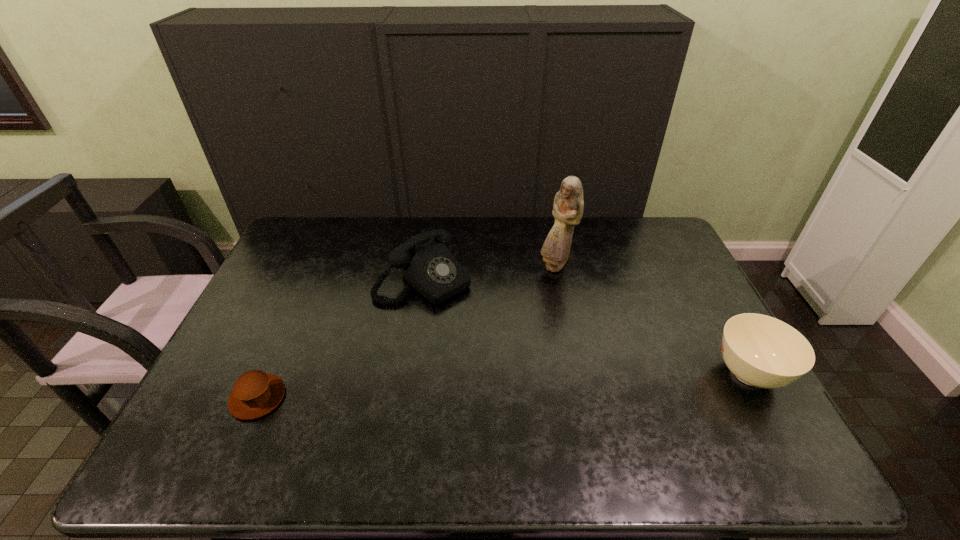
Locate an element on the screen. The width and height of the screenshot is (960, 540). the leftmost object is located at coordinates (255, 393).

You are a GUI agent. You are given a task and a screenshot of the screen. Output one action in this format:
    pyautogui.click(x=<x>, y=<y>)
    Task: Click on the shortest object
    The image size is (960, 540).
    Given the screenshot: What is the action you would take?
    pyautogui.click(x=255, y=393)

The image size is (960, 540). I want to click on sugar bowl, so click(762, 351).

At what (x,y) coordinates should I click in order to perform the action: click on the second object from right to left. Please return your answer as a coordinate pair (x, y). Image resolution: width=960 pixels, height=540 pixels. Looking at the image, I should click on (568, 206).

Image resolution: width=960 pixels, height=540 pixels. In order to click on the tallest object in this screenshot , I will do `click(568, 206)`.

This screenshot has width=960, height=540. I want to click on telephone, so click(426, 263).

What are the coordinates of `free space located on the left of the shortest object` in the screenshot? It's located at (211, 397).

Find the location of a particular element. This screenshot has width=960, height=540. vacant region located 0.250m on the back of the sugar bowl is located at coordinates (699, 284).

This screenshot has width=960, height=540. I want to click on vacant region located on the front-facing side of the tallest object, so click(555, 303).

The height and width of the screenshot is (540, 960). Find the location of `blank space located on the front-facing side of the tallest object`. blank space located on the front-facing side of the tallest object is located at coordinates (555, 315).